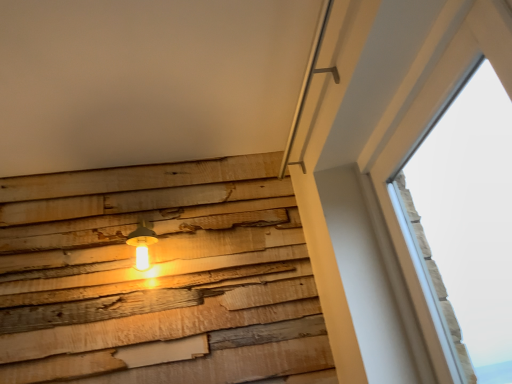
Question: In the image, is matte yellow glass lamp at center-left positioned in front of or behind transparent glass window at upper right?

Choices:
 (A) front
 (B) behind

Answer: (B)

Question: Is matte yellow glass lamp at center-left wider or thinner than transparent glass window at upper right?

Choices:
 (A) wide
 (B) thin

Answer: (A)

Question: In terms of size, does matte yellow glass lamp at center-left appear bigger or smaller than transparent glass window at upper right?

Choices:
 (A) big
 (B) small

Answer: (B)

Question: Considering the positions of transparent glass window at upper right and matte yellow glass lamp at center-left in the image, is transparent glass window at upper right wider or thinner than matte yellow glass lamp at center-left?

Choices:
 (A) wide
 (B) thin

Answer: (B)

Question: Considering the positions of transparent glass window at upper right and matte yellow glass lamp at center-left in the image, is transparent glass window at upper right taller or shorter than matte yellow glass lamp at center-left?

Choices:
 (A) tall
 (B) short

Answer: (A)

Question: From the image's perspective, is transparent glass window at upper right positioned above or below matte yellow glass lamp at center-left?

Choices:
 (A) below
 (B) above

Answer: (B)

Question: In terms of size, does transparent glass window at upper right appear bigger or smaller than matte yellow glass lamp at center-left?

Choices:
 (A) small
 (B) big

Answer: (B)